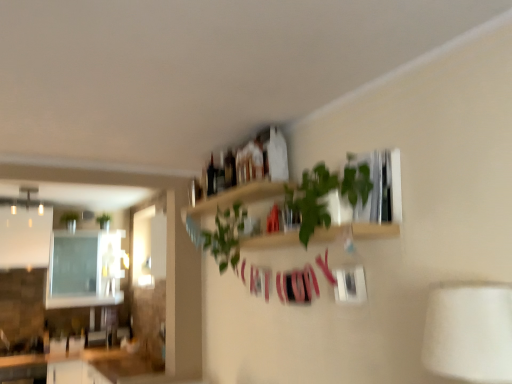
Question: From the image's perspective, is green leafy plant at upper center, the 1th plant when ordered from right to left, positioned above or below green matte plant at upper left, placed as the second plant when sorted from front to back?

Choices:
 (A) above
 (B) below

Answer: (A)

Question: Looking at their shapes, would you say green leafy plant at upper center, which ranks as the 1th plant in front-to-back order, is wider or thinner than green matte plant at upper left, which appears as the 1th plant when viewed from the left?

Choices:
 (A) thin
 (B) wide

Answer: (A)

Question: Which of these objects is positioned farthest from the black glass bottle at upper center, the 1th bottle from the left?

Choices:
 (A) green matte plant at upper left, placed as the second plant when sorted from front to back
 (B) green leafy plant at upper center, the second plant from the left
 (C) white glossy countertop at lower left
 (D) green leafy plant at upper center
 (E) white fabric lampshade at lower right

Answer: (A)

Question: Which is nearer to the green leafy plant at upper center, the second plant from the left?

Choices:
 (A) wooden shelf at upper center, the 2th shelf ordered from the bottom
 (B) matte black bottle at upper center, placed as the first bottle when sorted from front to back
 (C) black glass bottle at upper center, which ranks as the 1th bottle in back-to-front order
 (D) green leafy plant at upper center
 (E) green leafy plant at upper center, marked as the first shelf in a bottom-to-top arrangement

Answer: (A)